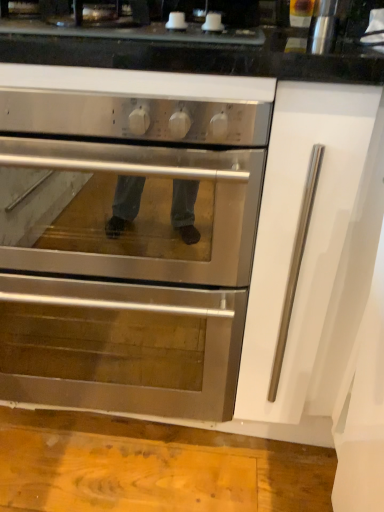
Question: Are satin black cooktop at upper center and stainless steel oven at center located far from each other?

Choices:
 (A) yes
 (B) no

Answer: (B)

Question: Does satin black cooktop at upper center appear on the right side of stainless steel oven at center?

Choices:
 (A) no
 (B) yes

Answer: (B)

Question: Is satin black cooktop at upper center surrounding stainless steel oven at center?

Choices:
 (A) no
 (B) yes

Answer: (A)

Question: Is satin black cooktop at upper center at the left side of stainless steel oven at center?

Choices:
 (A) yes
 (B) no

Answer: (B)

Question: Considering the relative sizes of satin black cooktop at upper center and stainless steel oven at center in the image provided, is satin black cooktop at upper center bigger than stainless steel oven at center?

Choices:
 (A) no
 (B) yes

Answer: (A)

Question: Is satin black cooktop at upper center looking in the opposite direction of stainless steel oven at center?

Choices:
 (A) no
 (B) yes

Answer: (A)

Question: From the image's perspective, does metallic cylindrical container at upper right appear lower than stainless steel oven at center?

Choices:
 (A) yes
 (B) no

Answer: (B)

Question: Is metallic cylindrical container at upper right turned away from stainless steel oven at center?

Choices:
 (A) yes
 (B) no

Answer: (B)

Question: Does metallic cylindrical container at upper right have a lesser height compared to stainless steel oven at center?

Choices:
 (A) no
 (B) yes

Answer: (B)

Question: Could you tell me if metallic cylindrical container at upper right is turned towards stainless steel oven at center?

Choices:
 (A) no
 (B) yes

Answer: (A)

Question: Is metallic cylindrical container at upper right in front of stainless steel oven at center?

Choices:
 (A) no
 (B) yes

Answer: (A)

Question: From a real-world perspective, is metallic cylindrical container at upper right over stainless steel oven at center?

Choices:
 (A) yes
 (B) no

Answer: (A)

Question: Is satin black cooktop at upper center surrounding metallic cylindrical container at upper right?

Choices:
 (A) yes
 (B) no

Answer: (B)